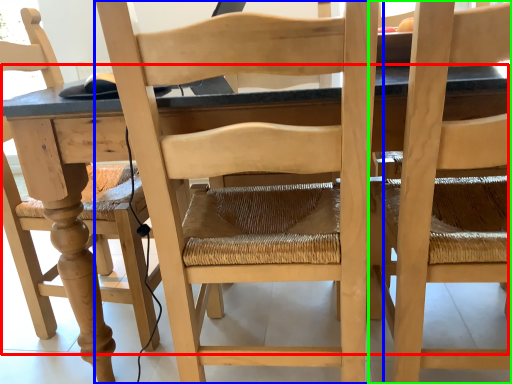
Question: Which object is positioned closest to table (highlighted by a red box)? Select from chair (highlighted by a blue box) and chair (highlighted by a green box).

Choices:
 (A) chair
 (B) chair

Answer: (A)